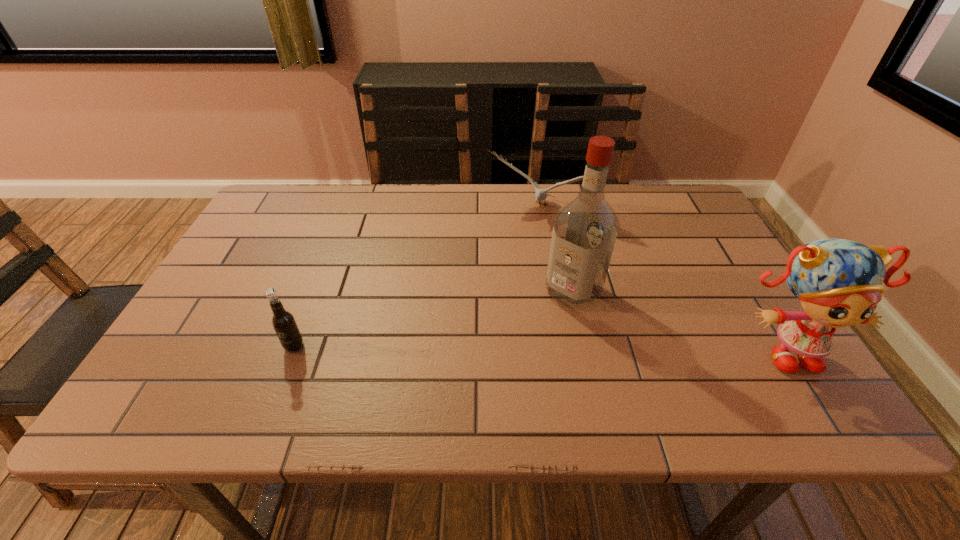
I want to click on root beer, so click(x=283, y=322).

You are a GUI agent. You are given a task and a screenshot of the screen. Output one action in this format:
    pyautogui.click(x=<x>, y=<y>)
    Task: Click on the second tallest object
    
    Given the screenshot: What is the action you would take?
    pyautogui.click(x=838, y=281)

This screenshot has height=540, width=960. I want to click on doll, so click(x=838, y=281).

Find the location of a particular element. The width and height of the screenshot is (960, 540). the farthest object is located at coordinates (540, 194).

Image resolution: width=960 pixels, height=540 pixels. Identify the location of the tallest object. (584, 232).

The width and height of the screenshot is (960, 540). I want to click on liquor, so click(x=584, y=232).

Locate an element on the screen. vacant region located on the label of the root beer is located at coordinates (283, 374).

Where is `vacant space situated 0.240m at the tip of the beak of the farthest object`? The height and width of the screenshot is (540, 960). vacant space situated 0.240m at the tip of the beak of the farthest object is located at coordinates (495, 276).

This screenshot has width=960, height=540. What are the coordinates of `free space located 0.120m at the tip of the beak of the farthest object` in the screenshot? It's located at (510, 248).

Locate an element on the screen. This screenshot has width=960, height=540. free space located 0.210m at the tip of the beak of the farthest object is located at coordinates (499, 269).